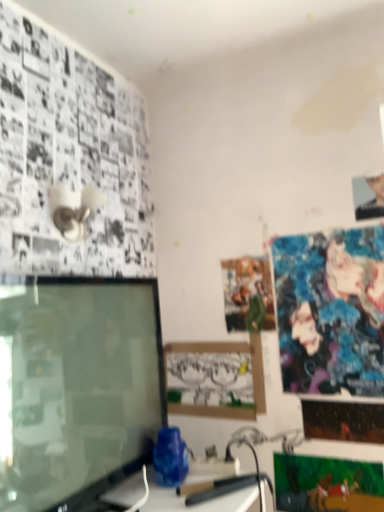
Question: Considering the relative sizes of shiny blue fabric poster at upper right, the 3th poster page in the bottom-to-top sequence, and smooth skin portrait at upper right in the image provided, is shiny blue fabric poster at upper right, the 3th poster page in the bottom-to-top sequence, shorter than smooth skin portrait at upper right?

Choices:
 (A) yes
 (B) no

Answer: (B)

Question: Does shiny blue fabric poster at upper right, the second poster page in the top-to-bottom sequence, lie behind smooth skin portrait at upper right?

Choices:
 (A) no
 (B) yes

Answer: (A)

Question: Can you confirm if shiny blue fabric poster at upper right, the 3th poster page in the bottom-to-top sequence, is smaller than smooth skin portrait at upper right?

Choices:
 (A) no
 (B) yes

Answer: (A)

Question: Can you confirm if shiny blue fabric poster at upper right, the second poster page in the top-to-bottom sequence, is positioned to the left of smooth skin portrait at upper right?

Choices:
 (A) no
 (B) yes

Answer: (B)

Question: From the image's perspective, is shiny blue fabric poster at upper right, the second poster page in the top-to-bottom sequence, located beneath smooth skin portrait at upper right?

Choices:
 (A) no
 (B) yes

Answer: (B)

Question: From a real-world perspective, is shiny blue fabric poster at upper right, the 3th poster page in the bottom-to-top sequence, on top of smooth skin portrait at upper right?

Choices:
 (A) no
 (B) yes

Answer: (A)

Question: Is shiny blue fabric poster at upper right, the 3th poster page in the bottom-to-top sequence, positioned with its back to shiny metallic poster at lower right, which is the 2th poster page in bottom-to-top order?

Choices:
 (A) no
 (B) yes

Answer: (A)

Question: Does shiny blue fabric poster at upper right, the second poster page in the top-to-bottom sequence, have a greater width compared to shiny metallic poster at lower right, the 3th poster page from the top?

Choices:
 (A) yes
 (B) no

Answer: (A)

Question: Can you confirm if shiny blue fabric poster at upper right, the 3th poster page in the bottom-to-top sequence, is smaller than shiny metallic poster at lower right, the 3th poster page from the top?

Choices:
 (A) yes
 (B) no

Answer: (B)

Question: Is shiny blue fabric poster at upper right, the 3th poster page in the bottom-to-top sequence, further to the viewer compared to shiny metallic poster at lower right, which is the 2th poster page in bottom-to-top order?

Choices:
 (A) yes
 (B) no

Answer: (B)

Question: Does shiny blue fabric poster at upper right, the 3th poster page in the bottom-to-top sequence, have a larger size compared to shiny metallic poster at lower right, the 3th poster page from the top?

Choices:
 (A) no
 (B) yes

Answer: (B)

Question: Does shiny blue fabric poster at upper right, the 3th poster page in the bottom-to-top sequence, appear on the left side of shiny metallic poster at lower right, which is the 2th poster page in bottom-to-top order?

Choices:
 (A) yes
 (B) no

Answer: (A)

Question: Is shiny blue fabric poster at upper right, the 3th poster page in the bottom-to-top sequence, surrounded by matte paper poster at center, which ranks as the first poster page in top-to-bottom order?

Choices:
 (A) no
 (B) yes

Answer: (A)